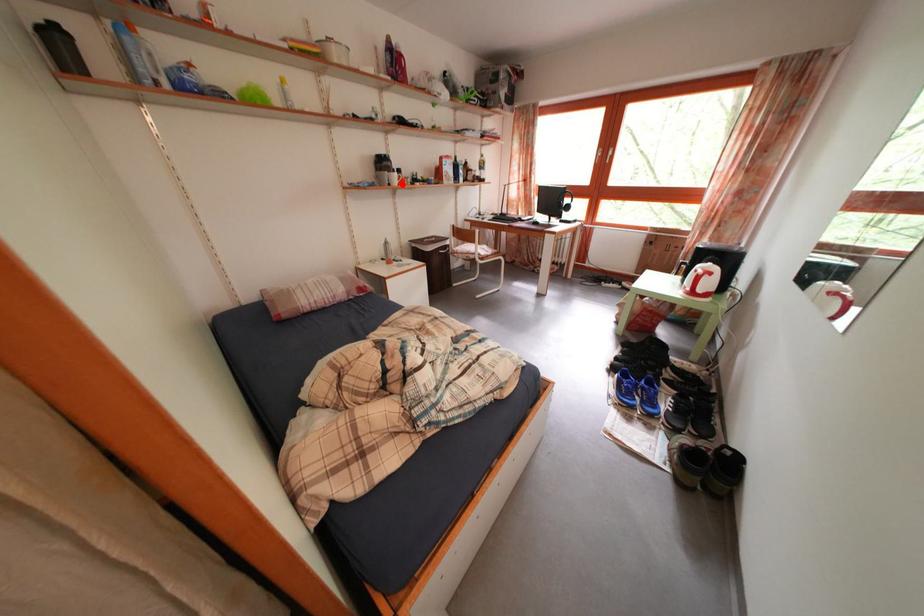
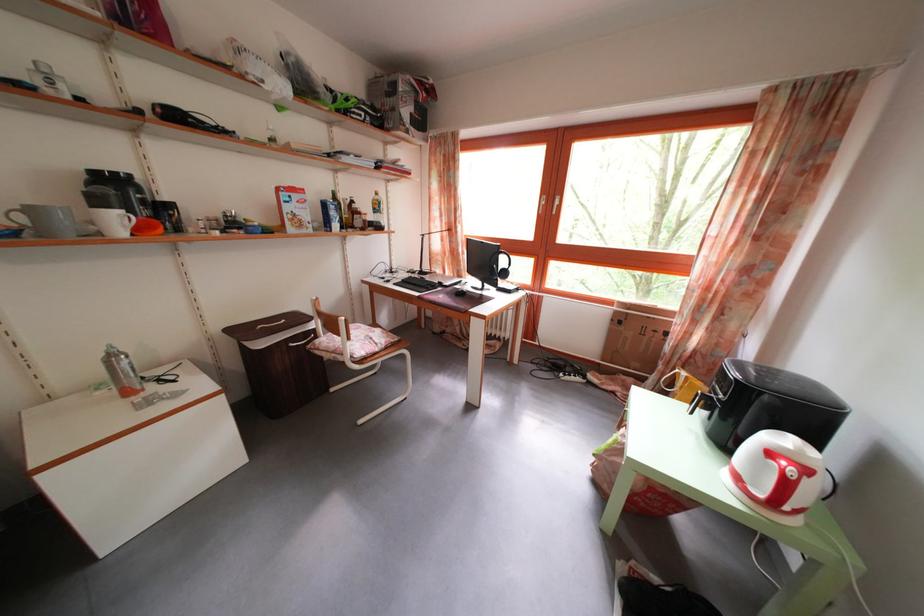
Where in the second image is the point corresponding to the highlighted location from the first image?

(125, 227)